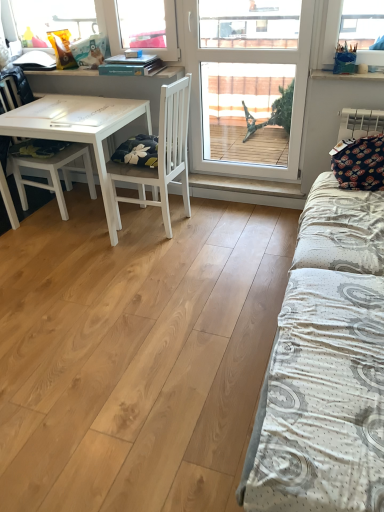
Identify the location of transparent glass window at center. The height and width of the screenshot is (512, 384). (246, 83).

What is the approximate height of white matte chair at left, the 2th chair viewed from the right?

The height of white matte chair at left, the 2th chair viewed from the right, is 38.31 inches.

The height and width of the screenshot is (512, 384). Describe the element at coordinates (78, 129) in the screenshot. I see `white matte table at left` at that location.

The width and height of the screenshot is (384, 512). Describe the element at coordinates (360, 164) in the screenshot. I see `dark blue fabric pillow at right` at that location.

The height and width of the screenshot is (512, 384). What are the coordinates of `white textured bed at right` in the screenshot? It's located at (325, 365).

I want to click on white matte chair at center, which ranks as the 2th chair in left-to-right order, so click(x=161, y=156).

Considering the sizes of objects white matte chair at left, the 2th chair viewed from the right, and white plastic bag at upper right in the image provided, who is shorter, white matte chair at left, the 2th chair viewed from the right, or white plastic bag at upper right?

Standing shorter between the two is white plastic bag at upper right.

Based on the photo, who is smaller, white matte chair at left, which is counted as the 1th chair, starting from the left, or white plastic bag at upper right?

white plastic bag at upper right.

Measure the distance from white matte chair at left, the 2th chair viewed from the right, to white plastic bag at upper right.

white matte chair at left, the 2th chair viewed from the right, and white plastic bag at upper right are 2.12 meters apart.

From a real-world perspective, is white matte chair at left, the 2th chair viewed from the right, above or below white plastic bag at upper right?

In terms of real-world spatial position, white matte chair at left, the 2th chair viewed from the right, is below white plastic bag at upper right.

Identify the location of table on the left side of white matte chair at center, which ranks as the 2th chair in left-to-right order. The image size is (384, 512). (78, 129).

Is white matte table at left looking in the opposite direction of white matte chair at center, arranged as the 1th chair when viewed from the right?

No.

From the image's perspective, is white matte table at left beneath white matte chair at center, arranged as the 1th chair when viewed from the right?

Correct, white matte table at left appears lower than white matte chair at center, arranged as the 1th chair when viewed from the right, in the image.

Considering the relative sizes of white matte table at left and white matte chair at center, which ranks as the 2th chair in left-to-right order, in the image provided, is white matte table at left shorter than white matte chair at center, which ranks as the 2th chair in left-to-right order,?

Yes.

Is dark blue fabric pillow at right positioned behind white matte chair at center, arranged as the 1th chair when viewed from the right?

Yes, dark blue fabric pillow at right is behind white matte chair at center, arranged as the 1th chair when viewed from the right.

Is dark blue fabric pillow at right taller or shorter than white matte chair at center, which ranks as the 2th chair in left-to-right order?

Clearly, dark blue fabric pillow at right is shorter compared to white matte chair at center, which ranks as the 2th chair in left-to-right order.

Based on the photo, from the image's perspective, is dark blue fabric pillow at right positioned above or below white matte chair at center, which ranks as the 2th chair in left-to-right order?

dark blue fabric pillow at right is above white matte chair at center, which ranks as the 2th chair in left-to-right order.

The image size is (384, 512). I want to click on chair in front of the dark blue fabric pillow at right, so click(161, 156).

From the image's perspective, which one is positioned lower, transparent glass window at center or white matte chair at left, the 2th chair viewed from the right?

white matte chair at left, the 2th chair viewed from the right, is shown below in the image.

Considering the sizes of objects transparent glass window at center and white matte chair at left, which is counted as the 1th chair, starting from the left, in the image provided, who is shorter, transparent glass window at center or white matte chair at left, which is counted as the 1th chair, starting from the left,?

white matte chair at left, which is counted as the 1th chair, starting from the left, is shorter.

Would you say transparent glass window at center is a long distance from white matte chair at left, the 2th chair viewed from the right?

Yes, transparent glass window at center and white matte chair at left, the 2th chair viewed from the right, are quite far apart.

In the scene shown: Would you say transparent glass window at center is inside or outside white matte chair at left, which is counted as the 1th chair, starting from the left?

transparent glass window at center is not enclosed by white matte chair at left, which is counted as the 1th chair, starting from the left.

From a real-world perspective, which is physically above, white matte chair at center, which ranks as the 2th chair in left-to-right order, or transparent glass window at center?

transparent glass window at center, from a real-world perspective.

Is white matte chair at center, which ranks as the 2th chair in left-to-right order, behind transparent glass window at center?

No, white matte chair at center, which ranks as the 2th chair in left-to-right order, is in front of transparent glass window at center.

From the image's perspective, between white matte chair at center, arranged as the 1th chair when viewed from the right, and transparent glass window at center, who is located below?

white matte chair at center, arranged as the 1th chair when viewed from the right, appears lower in the image.

Between white matte chair at center, arranged as the 1th chair when viewed from the right, and white matte chair at left, the 2th chair viewed from the right, which one has larger size?

With larger size is white matte chair at left, the 2th chair viewed from the right.

Considering the sizes of white matte chair at center, which ranks as the 2th chair in left-to-right order, and white matte chair at left, the 2th chair viewed from the right, in the image, is white matte chair at center, which ranks as the 2th chair in left-to-right order, wider or thinner than white matte chair at left, the 2th chair viewed from the right,?

Clearly, white matte chair at center, which ranks as the 2th chair in left-to-right order, has less width compared to white matte chair at left, the 2th chair viewed from the right.

Which is farther from the camera, (152, 186) or (5, 88)?

The point (5, 88) is more distant.

Image resolution: width=384 pixels, height=512 pixels. I want to click on chair that appears below the white matte chair at left, which is counted as the 1th chair, starting from the left (from the image's perspective), so click(161, 156).

From the image's perspective, between white matte chair at left, which is counted as the 1th chair, starting from the left, and white matte chair at center, which ranks as the 2th chair in left-to-right order, which one is located above?

white matte chair at left, which is counted as the 1th chair, starting from the left, from the image's perspective.

Is white matte chair at left, the 2th chair viewed from the right, in front of white matte chair at center, which ranks as the 2th chair in left-to-right order?

No, the depth of white matte chair at left, the 2th chair viewed from the right, is greater than that of white matte chair at center, which ranks as the 2th chair in left-to-right order.

Is white matte chair at left, which is counted as the 1th chair, starting from the left, inside or outside of white matte chair at center, arranged as the 1th chair when viewed from the right?

white matte chair at left, which is counted as the 1th chair, starting from the left, exists outside the volume of white matte chair at center, arranged as the 1th chair when viewed from the right.

Find the location of `chair located below the white matte chair at left, the 2th chair viewed from the right (from the image's perspective)`. chair located below the white matte chair at left, the 2th chair viewed from the right (from the image's perspective) is located at coordinates (161, 156).

Where is `the 1st chair below when counting from the white plastic bag at upper right (from the image's perspective)`? The width and height of the screenshot is (384, 512). the 1st chair below when counting from the white plastic bag at upper right (from the image's perspective) is located at coordinates (9, 93).

I want to click on the 1st chair above the white matte table at left (from the image's perspective), so click(161, 156).

Estimate the real-world distances between objects in this image. Which object is closer to white textured bed at right, white matte table at left or transparent glass window at center?

Among the two, transparent glass window at center is located nearer to white textured bed at right.

From the image, which object appears to be farther from white matte table at left, white plastic bag at upper right or white textured bed at right?

white textured bed at right lies further to white matte table at left than the other object.

Based on the photo, based on their spatial positions, is white matte chair at center, which ranks as the 2th chair in left-to-right order, or dark blue fabric pillow at right closer to white plastic bag at upper right?

Among the two, dark blue fabric pillow at right is located nearer to white plastic bag at upper right.

Considering their positions, is white matte chair at left, which is counted as the 1th chair, starting from the left, positioned closer to white textured bed at right than transparent glass window at center?

transparent glass window at center.

When comparing their distances from white textured bed at right, does dark blue fabric pillow at right or white matte table at left seem further?

Based on the image, white matte table at left appears to be further to white textured bed at right.

Based on their spatial positions, is white textured bed at right or white plastic bag at upper right closer to dark blue fabric pillow at right?

white plastic bag at upper right is positioned closer to the anchor dark blue fabric pillow at right.

Looking at the image, which one is located closer to dark blue fabric pillow at right, white plastic bag at upper right or white matte table at left?

Based on the image, white plastic bag at upper right appears to be nearer to dark blue fabric pillow at right.

Estimate the real-world distances between objects in this image. Which object is closer to white matte table at left, white textured bed at right or white matte chair at center, arranged as the 1th chair when viewed from the right?

The object closer to white matte table at left is white matte chair at center, arranged as the 1th chair when viewed from the right.

This screenshot has height=512, width=384. Identify the location of window sill between white textured bed at right and white matte chair at left, the 2th chair viewed from the right, along the z-axis. (349, 75).

You are a GUI agent. You are given a task and a screenshot of the screen. Output one action in this format:
    pyautogui.click(x=<x>, y=<y>)
    Task: Click on the window sill between white matte chair at left, which is counted as the 1th chair, starting from the left, and dark blue fabric pillow at right
    The width and height of the screenshot is (384, 512).
    Given the screenshot: What is the action you would take?
    pyautogui.click(x=349, y=75)

Where is `chair situated between white matte chair at left, the 2th chair viewed from the right, and transparent glass window at center from left to right`? chair situated between white matte chair at left, the 2th chair viewed from the right, and transparent glass window at center from left to right is located at coordinates [161, 156].

Find the location of a particular element. This screenshot has width=384, height=512. window between white textured bed at right and white plastic bag at upper right in the front-back direction is located at coordinates (246, 83).